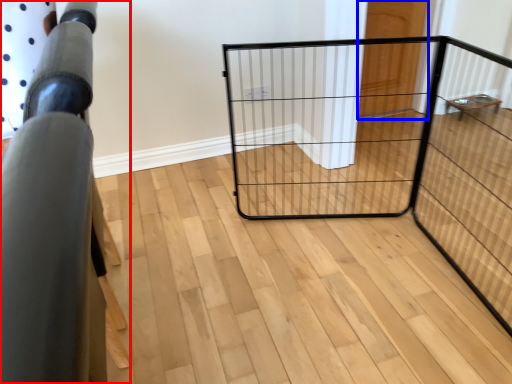
Question: Which object is further to the camera taking this photo, furniture (highlighted by a red box) or door (highlighted by a blue box)?

Choices:
 (A) furniture
 (B) door

Answer: (B)